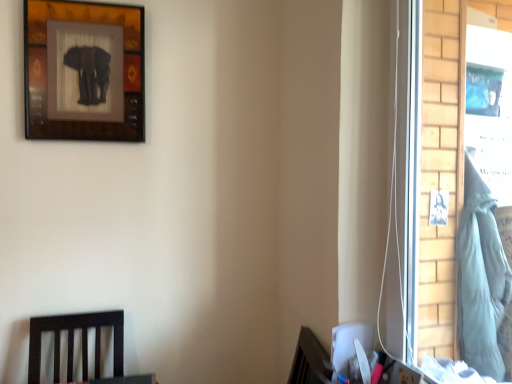
Question: From a real-world perspective, is wooden elephant art at upper left positioned above or below light blue fabric at right?

Choices:
 (A) above
 (B) below

Answer: (A)

Question: Considering the relative positions of wooden elephant art at upper left and light blue fabric at right in the image provided, is wooden elephant art at upper left to the left or to the right of light blue fabric at right?

Choices:
 (A) left
 (B) right

Answer: (A)

Question: Looking at their shapes, would you say wooden elephant art at upper left is wider or thinner than light blue fabric at right?

Choices:
 (A) thin
 (B) wide

Answer: (A)

Question: Is light blue fabric at right bigger or smaller than wooden elephant art at upper left?

Choices:
 (A) small
 (B) big

Answer: (B)

Question: Is light blue fabric at right to the left or to the right of wooden elephant art at upper left in the image?

Choices:
 (A) left
 (B) right

Answer: (B)

Question: Does point (495, 244) appear closer or farther from the camera than point (60, 104)?

Choices:
 (A) farther
 (B) closer

Answer: (B)

Question: From a real-world perspective, is light blue fabric at right physically located above or below wooden elephant art at upper left?

Choices:
 (A) below
 (B) above

Answer: (A)